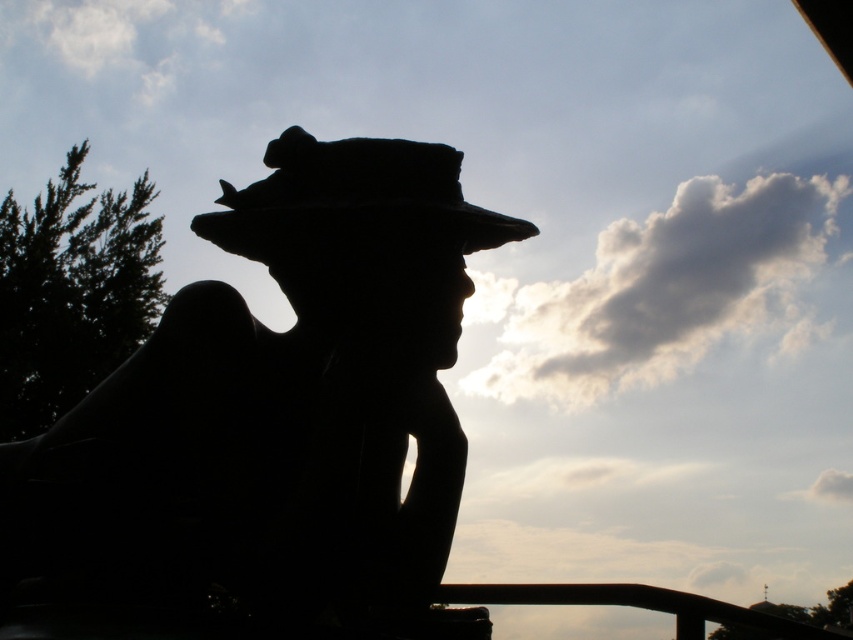
Between point (248, 452) and point (387, 218), which one is positioned behind?

Positioned behind is point (387, 218).

Between point (454, 468) and point (451, 224), which one is positioned behind?

Point (454, 468)

Where is `black matte statue at center`? This screenshot has width=853, height=640. black matte statue at center is located at coordinates point(270,426).